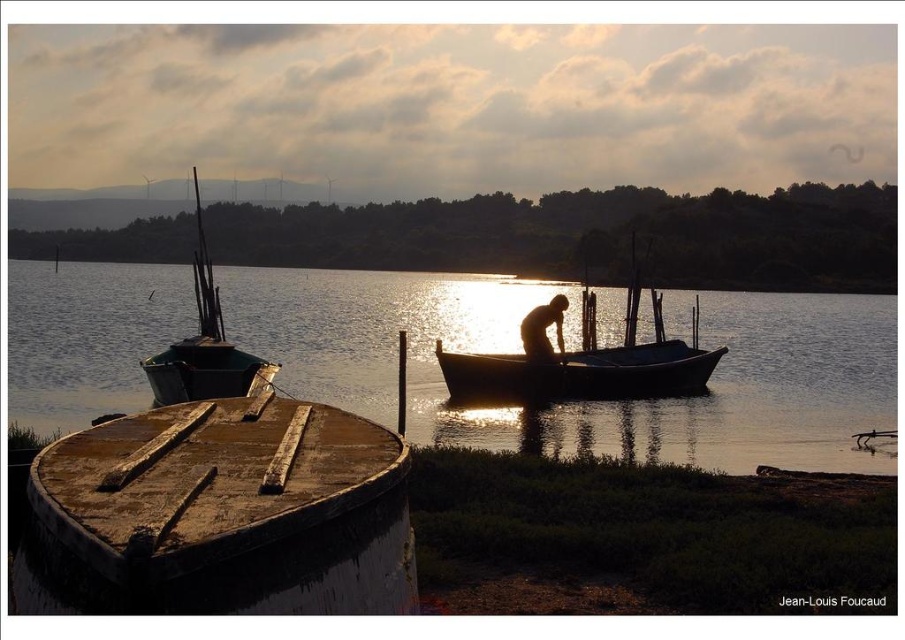
You are standing at the lakeside and want to take a photo of the green wooden boat at left and the smooth water at boat right. Which object should you focus on first if you want to capture both in one frame without moving the camera?

You should focus on the green wooden boat at left first because it is farther away from the viewer compared to the smooth water at boat right, allowing both to be in focus when using a single focal point.

You are standing on the lakeside and want to take a photo of the silhouette human at center without the green wooden boat at left appearing in the frame. Which direction should you move to achieve this?

Move to the right side of the silhouette human at center so that the green wooden boat at left is out of the frame to the left.

You are standing on the dock and want to move from the wooden boat at center to the silhouette human at center. Can you walk directly to them without needing to step into the water?

The distance between wooden boat at center and silhouette human at center is 1.19 meters. Since this distance is manageable on dry land, you can walk directly to them without stepping into the water.